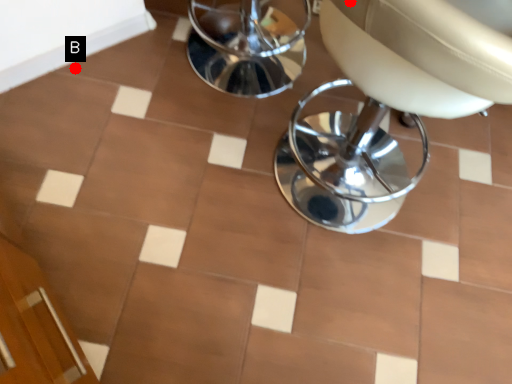
Question: Two points are circled on the image, labeled by A and B beside each circle. Which point is closer to the camera?

Choices:
 (A) A is closer
 (B) B is closer

Answer: (A)